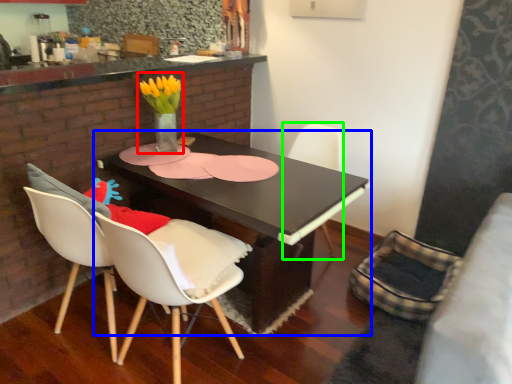
Question: Based on their relative distances, which object is farther from floral arrangement (highlighted by a red box)? Choose from table (highlighted by a blue box) and chair (highlighted by a green box).

Choices:
 (A) table
 (B) chair

Answer: (B)